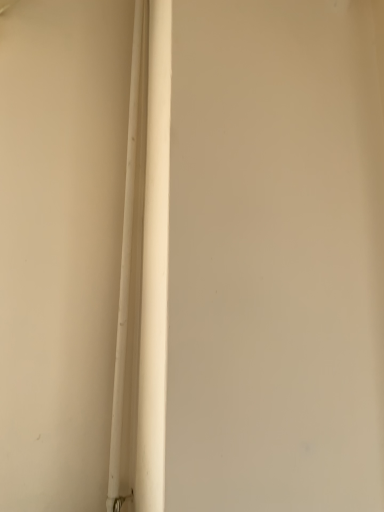
Question: Should I look upward or downward to see white matte pipe at center?

Choices:
 (A) down
 (B) up

Answer: (B)